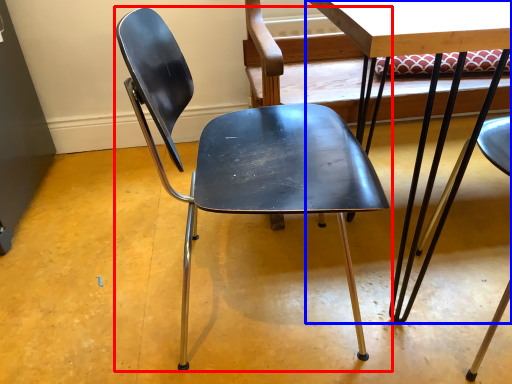
Question: Which object is closer to the camera taking this photo, chair (highlighted by a red box) or table (highlighted by a blue box)?

Choices:
 (A) chair
 (B) table

Answer: (B)